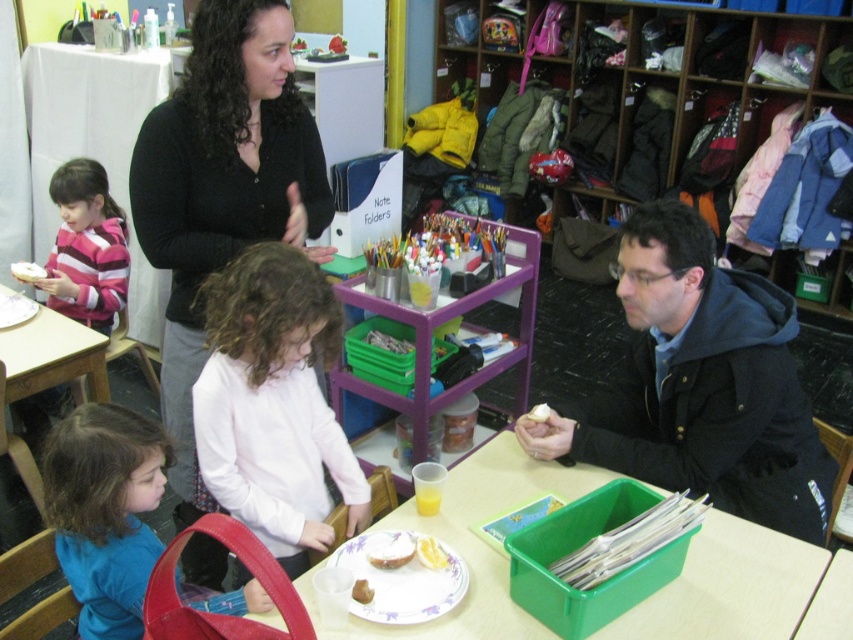
Looking at this image, you are a photographer setting up a shoot in this scene. You need to position a light source so that it illuminates both the black matte sweater at upper left and the white matte shirt at center without creating harsh shadows. Considering their heights, which object should the light be placed higher above to achieve this?

The light source should be placed higher above the black matte sweater at upper left because it is much taller than the white matte shirt at center, ensuring both receive even lighting without harsh shadows.

You are organizing a clothing donation drive and need to determine which item takes up more space. Based on the scene, which item is larger in size between the black matte sweater at upper left and the white matte shirt at center?

The black matte sweater at upper left is larger in size than the white matte shirt at center, so it takes up more space.

Consider the image. You are standing in the room and want to see both the black matte sweater at upper left and the white matte shirt at center. Which one is closer to you?

The black matte sweater at upper left is closer to you because the white matte shirt at center is behind it.